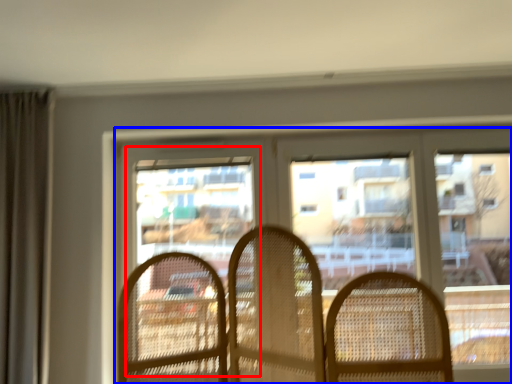
Question: Which of the following is the closest to the observer, screen door (highlighted by a red box) or window (highlighted by a blue box)?

Choices:
 (A) screen door
 (B) window

Answer: (B)